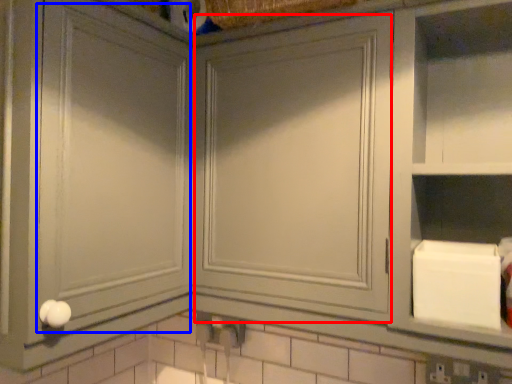
Question: Which of the following is the closest to the observer, glass door (highlighted by a red box) or glass door (highlighted by a blue box)?

Choices:
 (A) glass door
 (B) glass door

Answer: (B)